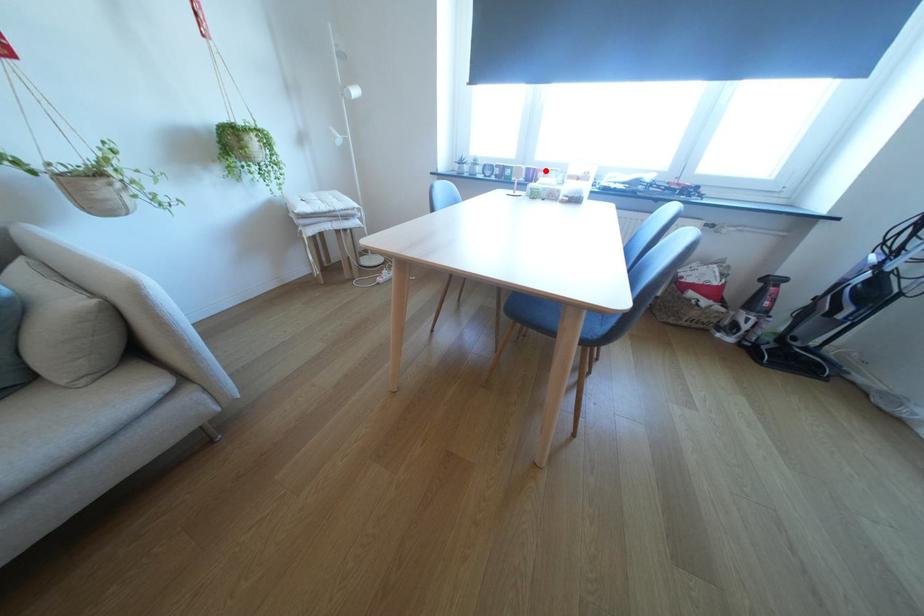
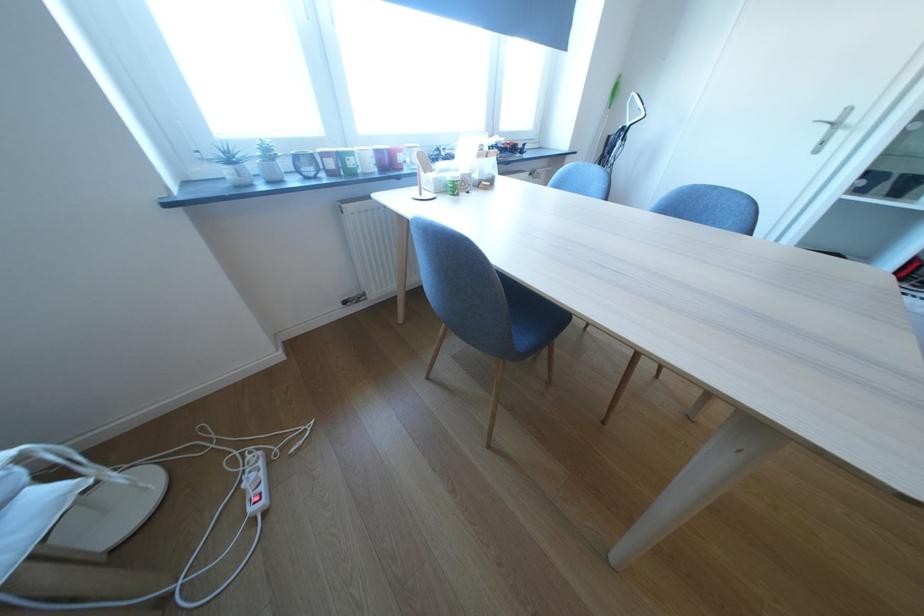
Question: I am providing you with two images of the same scene from different viewpoints. A red point is marked on the first image. At the location where the point appears in image 1, is it still visible in image 2?

Choices:
 (A) Yes
 (B) No

Answer: (A)